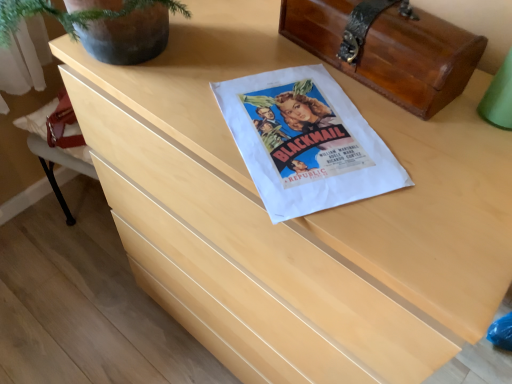
Question: Considering their positions, is shiny brown wood chest at upper right located in front of or behind white paper flyer at center?

Choices:
 (A) front
 (B) behind

Answer: (B)

Question: Does point (387, 13) appear closer or farther from the camera than point (272, 155)?

Choices:
 (A) farther
 (B) closer

Answer: (A)

Question: From a real-world perspective, is shiny brown wood chest at upper right physically located above or below white paper flyer at center?

Choices:
 (A) below
 (B) above

Answer: (B)

Question: Choose the correct answer: Is white paper flyer at center inside shiny brown wood chest at upper right or outside it?

Choices:
 (A) inside
 (B) outside

Answer: (B)

Question: Would you say white paper flyer at center is to the left or to the right of shiny brown wood chest at upper right in the picture?

Choices:
 (A) right
 (B) left

Answer: (B)

Question: In terms of height, does white paper flyer at center look taller or shorter compared to shiny brown wood chest at upper right?

Choices:
 (A) tall
 (B) short

Answer: (B)

Question: From the image's perspective, is white paper flyer at center above or below shiny brown wood chest at upper right?

Choices:
 (A) below
 (B) above

Answer: (A)